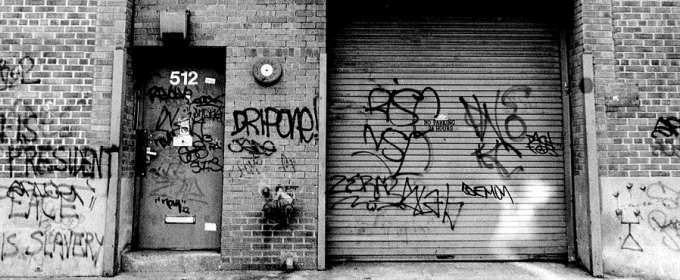
Where is `brick walls`? Image resolution: width=680 pixels, height=280 pixels. brick walls is located at coordinates (62, 85), (299, 82), (237, 212), (651, 38), (645, 126).